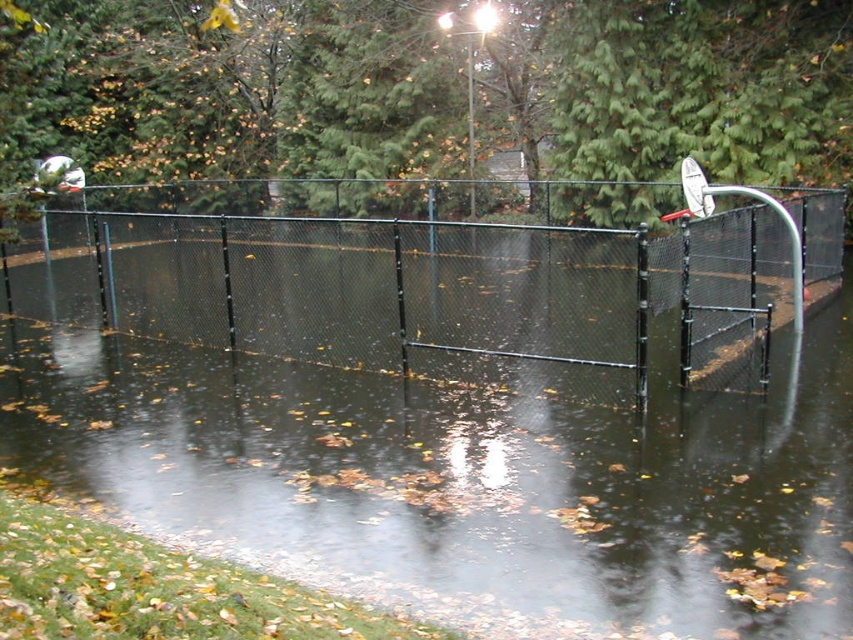
Is point (16, 380) positioned before point (693, 160)?

Yes, point (16, 380) is closer to viewer.

You are a GUI agent. You are given a task and a screenshot of the screen. Output one action in this format:
    pyautogui.click(x=<x>, y=<y>)
    Task: Click on the transparent water at center
    
    Given the screenshot: What is the action you would take?
    pyautogui.click(x=467, y=481)

Image resolution: width=853 pixels, height=640 pixels. I want to click on transparent water at center, so click(467, 481).

Who is lower down, black chain-link fence at center or white matte basketball hoop at upper right?

white matte basketball hoop at upper right is below.

Does black chain-link fence at center have a greater width compared to white matte basketball hoop at upper right?

Yes, black chain-link fence at center is wider than white matte basketball hoop at upper right.

Between point (639, 356) and point (711, 209), which one is positioned in front?

Point (639, 356)

Where is `black chain-link fence at center`? The image size is (853, 640). black chain-link fence at center is located at coordinates (422, 292).

Does transparent water at center appear on the right side of black chain-link fence at center?

In fact, transparent water at center is to the left of black chain-link fence at center.

Is transparent water at center in front of black chain-link fence at center?

That is True.

Which is behind, point (693, 564) or point (618, 336)?

Positioned behind is point (618, 336).

This screenshot has width=853, height=640. Identify the location of transparent water at center. (467, 481).